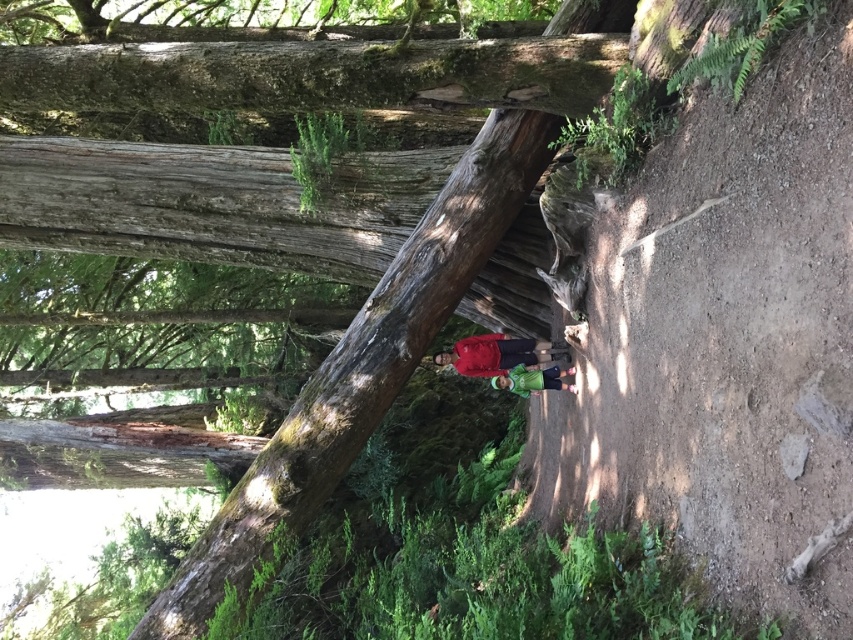
You are a hiker who wants to retrieve the green matte shirt at center from the forest floor. There is a red fabric jacket at center in the way. Which item should you move first to reach the shirt?

You should move the red fabric jacket at center first because it is closer to you than the green matte shirt at center, which is behind it.

In the scene shown: You are a hiker who wants to cross the forest floor. You see a smooth brown log at center and a green matte shirt at center. Which object is higher up and can serve as a stepping stone?

The smooth brown log at center is located above the green matte shirt at center, so it can serve as a higher stepping stone.